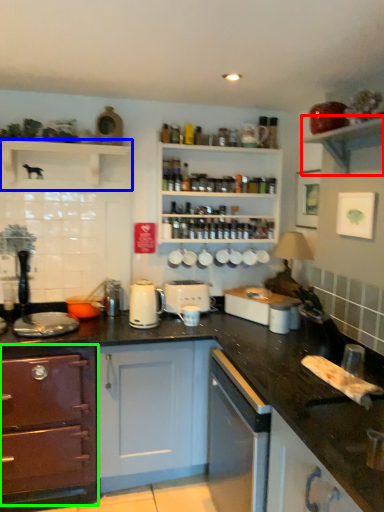
Question: Based on their relative distances, which object is farther from shelf (highlighted by a red box)? Choose from shelf (highlighted by a blue box) and cabinetry (highlighted by a green box).

Choices:
 (A) shelf
 (B) cabinetry

Answer: (B)